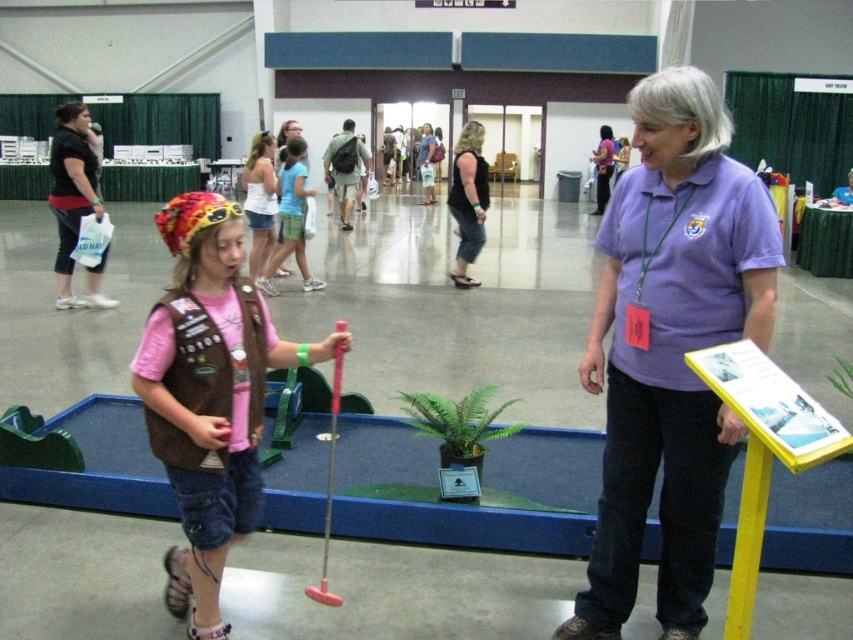
You are organizing a photo shoot and need to ensure that the black fabric pants at center and the purple shirt at center are both visible in the frame. Based on their sizes, which one should you prioritize positioning closer to the camera to ensure visibility?

The black fabric pants at center occupies less space than purple shirt at center, so you should prioritize positioning the black fabric pants at center closer to the camera to ensure visibility.